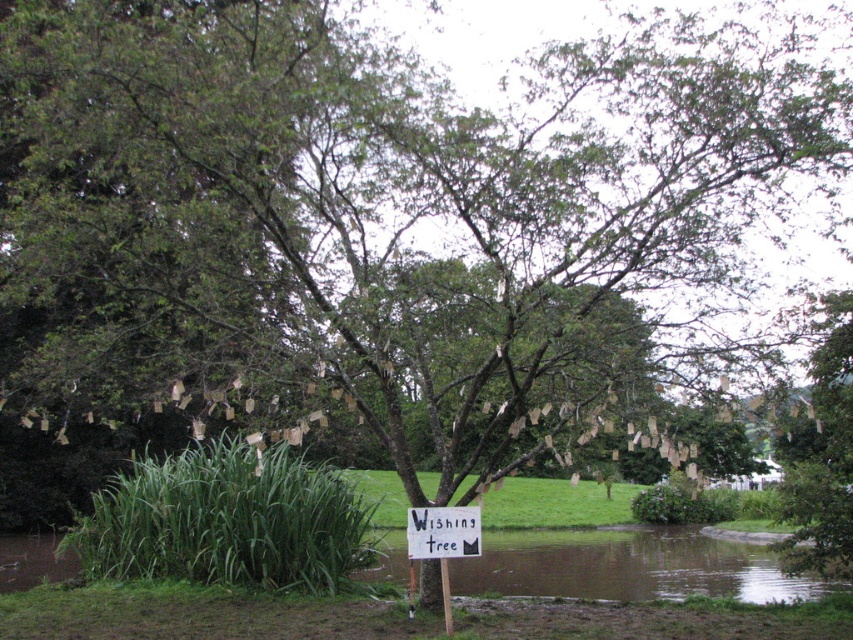
You are standing at the edge of the scene and want to walk towards the green leafy tree at upper right. Is there enough space between the brown murky water at lower center and the tree to walk through?

The brown murky water at lower center might be wider than green leafy tree at upper right, so there may not be enough space to walk through safely. It is advisable to find an alternative path to reach the tree without crossing the water.

You are a hiker who has just arrived at the scene and wants to place a new wish on the white paper sign at center. However, you notice the brown murky water at lower center. Is the water level high enough to reach the sign?

The brown murky water at lower center has a greater height compared to the white paper sign at center, so the water level is high enough to reach the white paper sign at center.

You are standing in the garden and want to take a photo of the green leafy tree at upper right and the white paper sign at center. Which object will appear larger in the photo?

The green leafy tree at upper right will appear larger in the photo because it is closer to the viewer than the white paper sign at center.